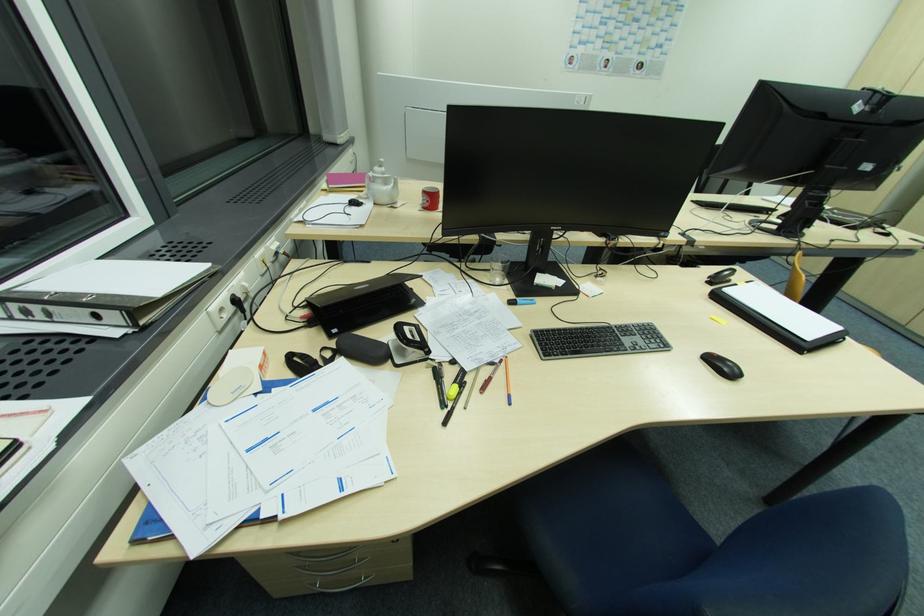
Image resolution: width=924 pixels, height=616 pixels. I want to click on black marker pen, so click(x=439, y=383).